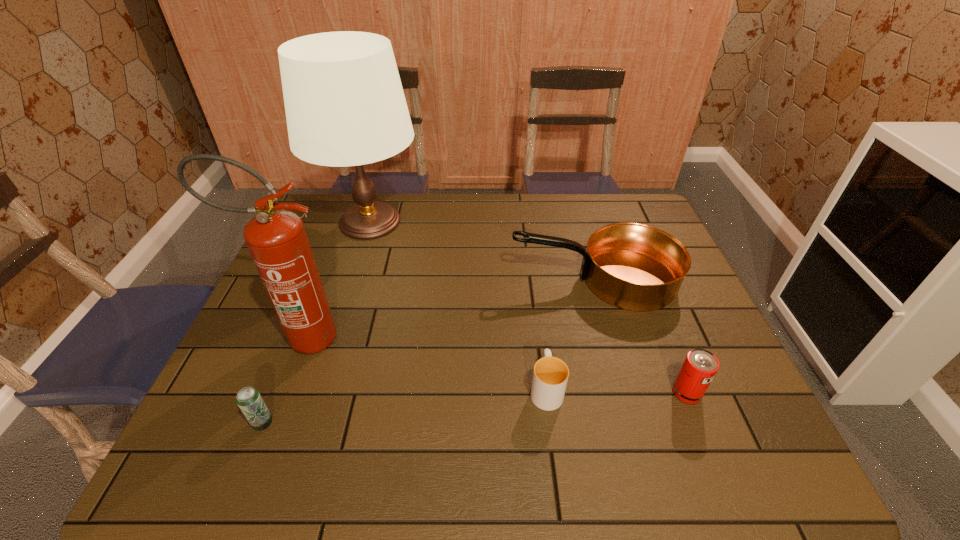
The image size is (960, 540). What are the coordinates of `vacant space located on the handle side of the frying pan` in the screenshot? It's located at (478, 280).

Where is `vacant area situated on the back of the can`? This screenshot has width=960, height=540. vacant area situated on the back of the can is located at coordinates (667, 343).

Where is `blank space located 0.260m on the back of the nearest object`? This screenshot has height=540, width=960. blank space located 0.260m on the back of the nearest object is located at coordinates (302, 323).

At what (x,y) coordinates should I click in order to perform the action: click on free location located 0.220m with the handle on the side of the cup. Please return your answer as a coordinate pair (x, y). This screenshot has height=540, width=960. Looking at the image, I should click on (535, 302).

The height and width of the screenshot is (540, 960). Identify the location of free space located with the handle on the side of the cup. pos(532,277).

Find the location of a particular element. The width and height of the screenshot is (960, 540). vacant area situated 0.090m with the handle on the side of the cup is located at coordinates (540, 339).

I want to click on object located at the far edge, so tap(345, 106).

You are a GUI agent. You are given a task and a screenshot of the screen. Output one action in this format:
    pyautogui.click(x=<x>, y=<y>)
    Task: Click on the lamp positioned at the left edge
    Image resolution: width=960 pixels, height=540 pixels.
    Given the screenshot: What is the action you would take?
    pyautogui.click(x=345, y=106)

What are the coordinates of `fire extinguisher present at the left edge` in the screenshot? It's located at (277, 240).

Where is `beer can situated at the left edge`? beer can situated at the left edge is located at coordinates (249, 400).